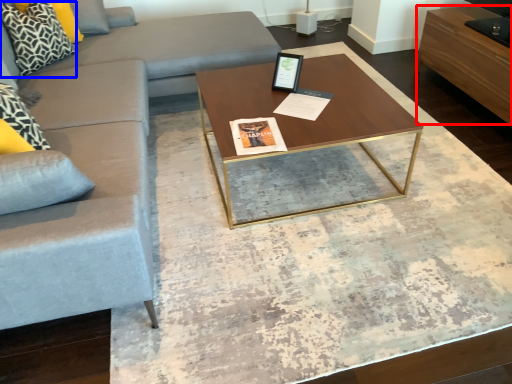
Question: Which point is closer to the camera, drawer (highlighted by a red box) or pillow (highlighted by a blue box)?

Choices:
 (A) drawer
 (B) pillow

Answer: (A)